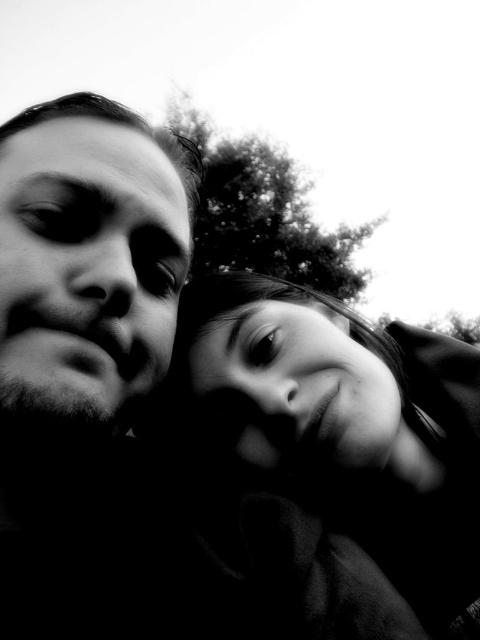
Can you confirm if smooth skin face at center is bigger than smooth skin face at left?

Yes, smooth skin face at center is bigger than smooth skin face at left.

Is smooth skin face at center wider than smooth skin face at left?

Yes.

The height and width of the screenshot is (640, 480). What are the coordinates of `smooth skin face at center` in the screenshot? It's located at (342, 426).

The image size is (480, 640). Identify the location of smooth skin face at center. (342, 426).